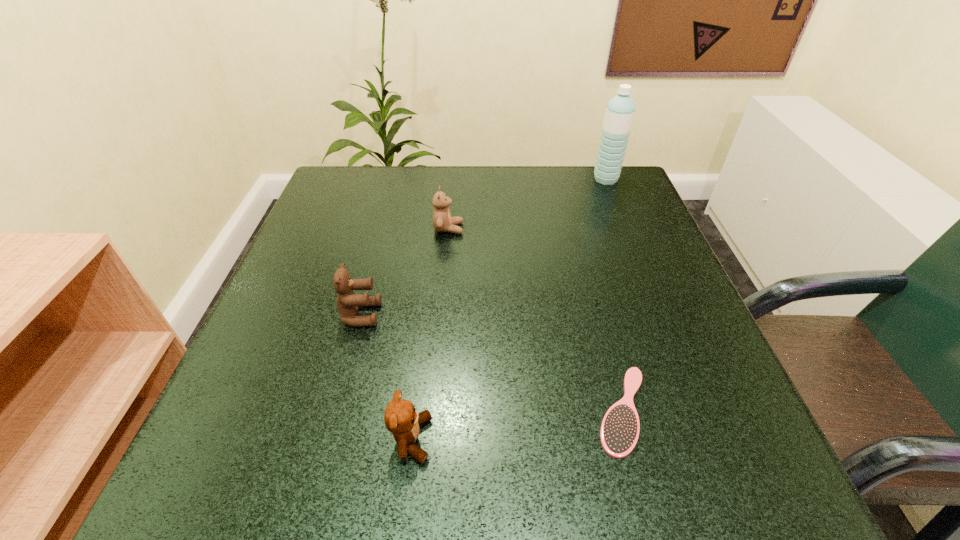
Identify which teddy bear is the nearest to the fourth nearest object. Please provide its 2D coordinates. Your answer should be formatted as a tuple, i.e. [(x, y)], where the tuple contains the x and y coordinates of a point satisfying the conditions above.

[(347, 301)]

Point out which teddy bear is positioned as the second nearest to the farthest teddy bear. Please provide its 2D coordinates. Your answer should be formatted as a tuple, i.e. [(x, y)], where the tuple contains the x and y coordinates of a point satisfying the conditions above.

[(400, 418)]

You are a GUI agent. You are given a task and a screenshot of the screen. Output one action in this format:
    pyautogui.click(x=<x>, y=<y>)
    Task: Click on the vacant space that satisfies the following two spatial constraints: 1. on the face of the second nearest teddy bear; 2. on the right side of the second object from right to left
    This screenshot has height=540, width=960.
    Given the screenshot: What is the action you would take?
    pyautogui.click(x=335, y=410)

At what (x,y) coordinates should I click in order to perform the action: click on free space that satisfies the following two spatial constraints: 1. on the back side of the shortest object; 2. on the face of the third farthest object. Please return your answer as a coordinate pair (x, y). This screenshot has width=960, height=540. Looking at the image, I should click on (598, 314).